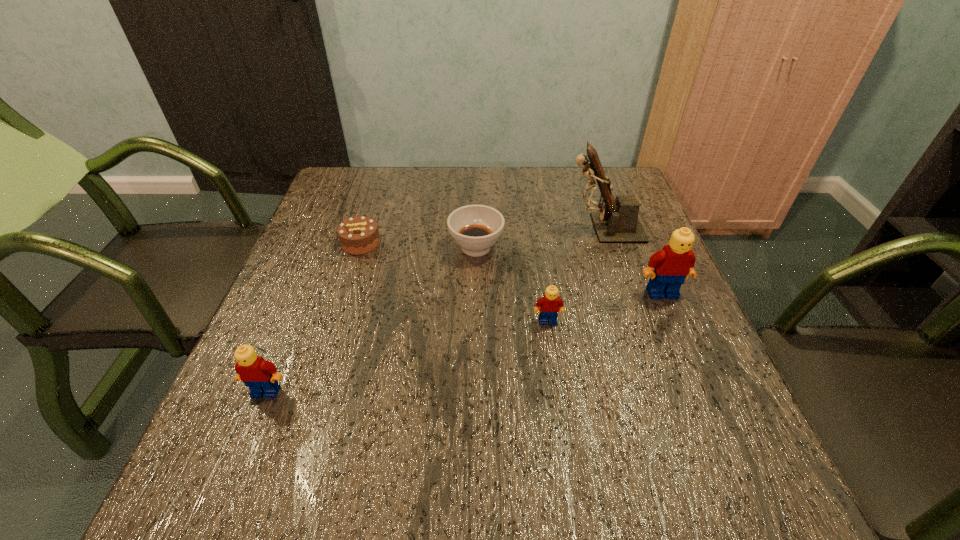
Identify the location of Lego situated at the right edge. (672, 264).

In order to click on figurine at the right edge in this screenshot , I will do `click(617, 222)`.

Find the location of a particular element. This screenshot has width=960, height=540. object at the near left corner is located at coordinates (261, 376).

Find the location of `vacant area at the far edge of the desktop`. vacant area at the far edge of the desktop is located at coordinates click(430, 198).

In the image, there is a desktop. Identify the location of blank space at the near edge. (363, 422).

Identify the location of vacant space at the left edge of the desktop. The width and height of the screenshot is (960, 540). (291, 293).

I want to click on free space at the far left corner of the desktop, so click(335, 209).

Where is `free space at the far right corner`? This screenshot has height=540, width=960. free space at the far right corner is located at coordinates (584, 202).

In the image, there is a desktop. Identify the location of free region at the near right corner. This screenshot has width=960, height=540. (721, 420).

At what (x,y) coordinates should I click in order to perform the action: click on free space between the tallest Lego and the fourth object from right to left. Please return your answer as a coordinate pair (x, y). Looking at the image, I should click on (569, 270).